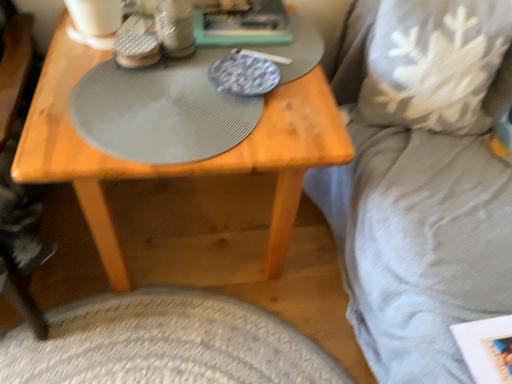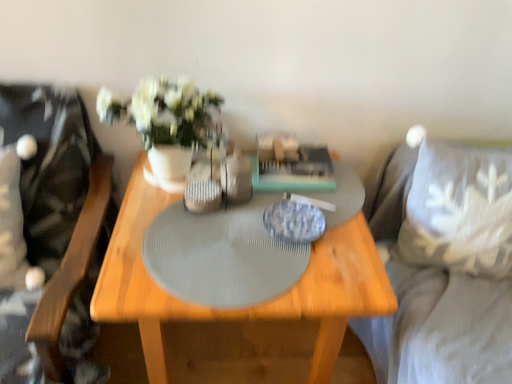
Question: How did the camera likely rotate when shooting the video?

Choices:
 (A) rotated upward
 (B) rotated downward

Answer: (A)